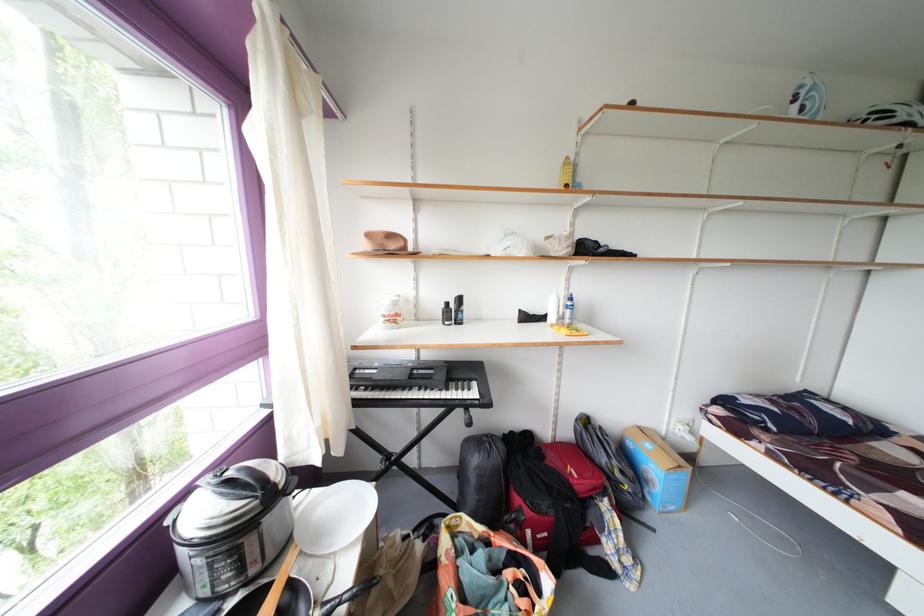
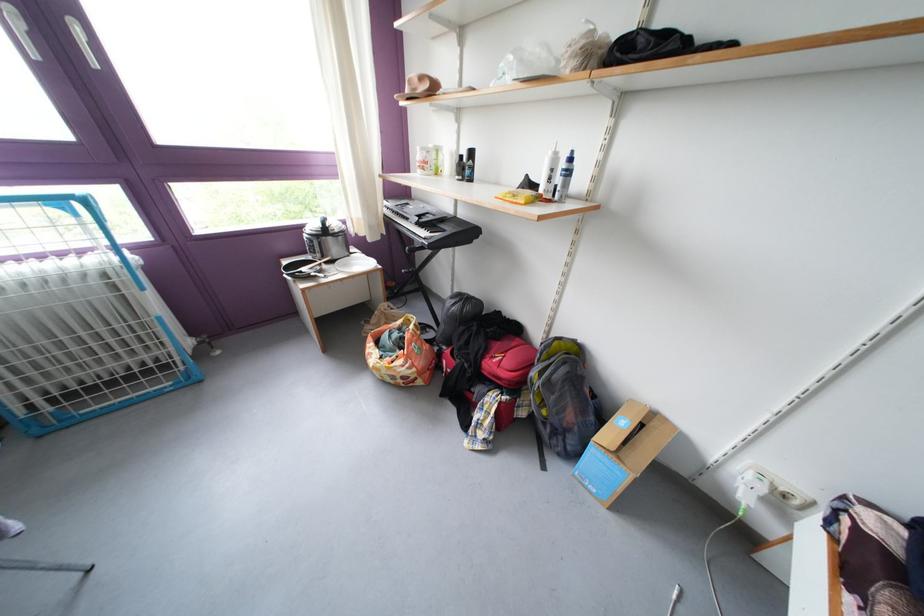
Find the pixel in the second image that matches pixel 631 541 in the first image.

(500, 426)